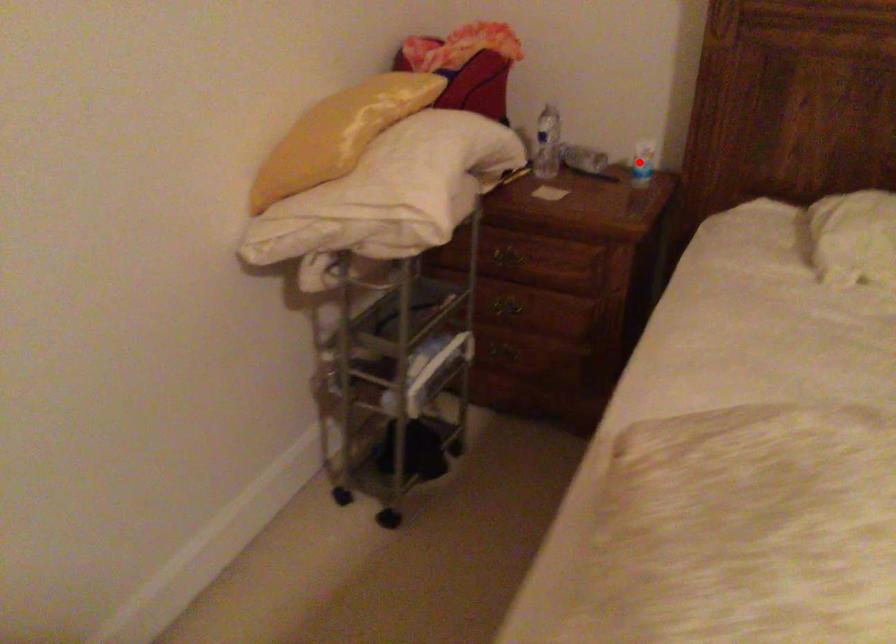
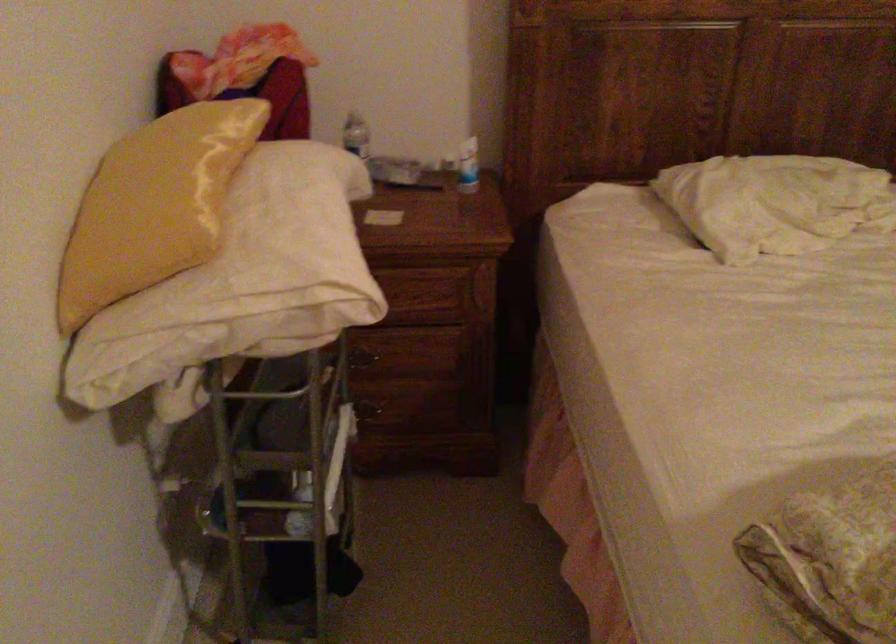
The point at the highlighted location is marked in the first image. Where is the corresponding point in the second image?

(468, 166)